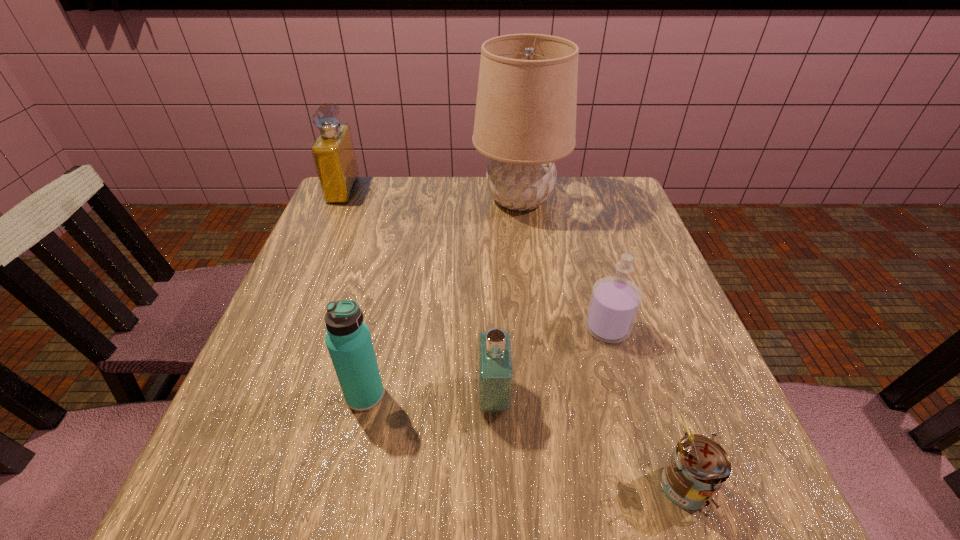
Find the location of a particular element. This screenshot has height=540, width=960. vacant region located on the front-facing side of the leftmost perfume is located at coordinates (485, 190).

You are a GUI agent. You are given a task and a screenshot of the screen. Output one action in this format:
    pyautogui.click(x=<x>, y=<y>)
    Task: Click on the free space located 0.170m on the right of the thermos bottle
    
    Given the screenshot: What is the action you would take?
    pyautogui.click(x=483, y=395)

Image resolution: width=960 pixels, height=540 pixels. I want to click on vacant region located on the left of the third farthest object, so click(448, 328).

Where is `free space located on the front label of the nearest perfume`? The height and width of the screenshot is (540, 960). free space located on the front label of the nearest perfume is located at coordinates (436, 397).

Locate an element on the screen. free space located on the front label of the nearest perfume is located at coordinates (377, 397).

What are the coordinates of `free spot located on the front label of the nearest perfume` in the screenshot? It's located at (390, 397).

Identify the location of free point located 0.180m on the left of the can. (528, 484).

This screenshot has height=540, width=960. I want to click on lampshade that is at the far edge, so click(x=525, y=119).

This screenshot has width=960, height=540. I want to click on perfume present at the far edge, so click(x=333, y=152).

You are a GUI agent. You are given a task and a screenshot of the screen. Output one action in this format:
    pyautogui.click(x=<x>, y=<y>)
    Task: Click on the object present at the near edge
    
    Given the screenshot: What is the action you would take?
    pyautogui.click(x=697, y=469)